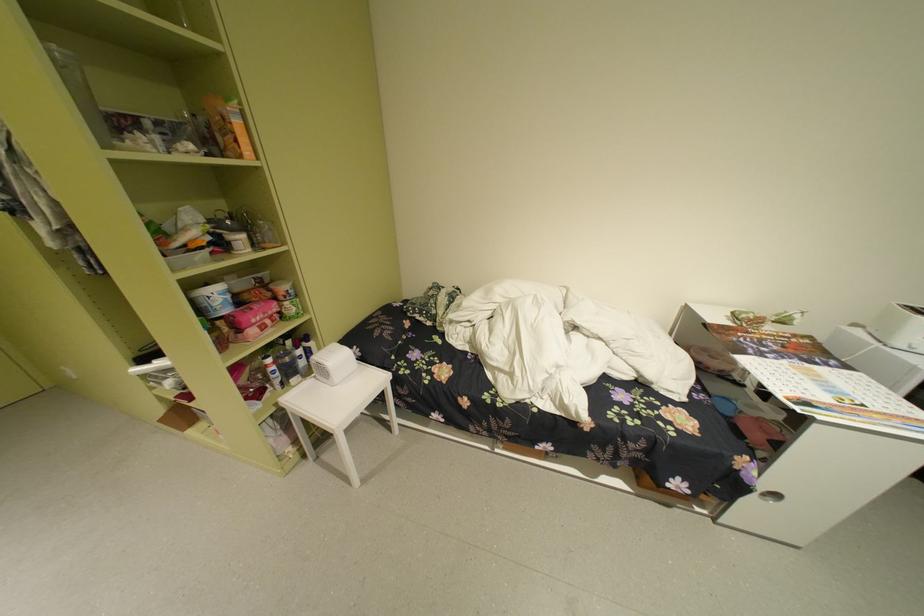
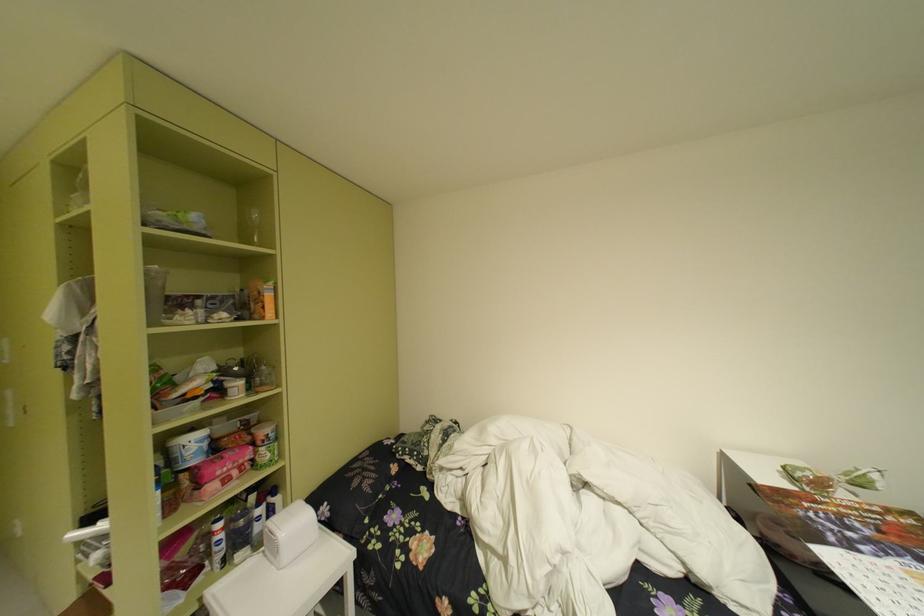
Find the pixel in the second image that matches (x=312, y=363) in the first image.

(269, 528)